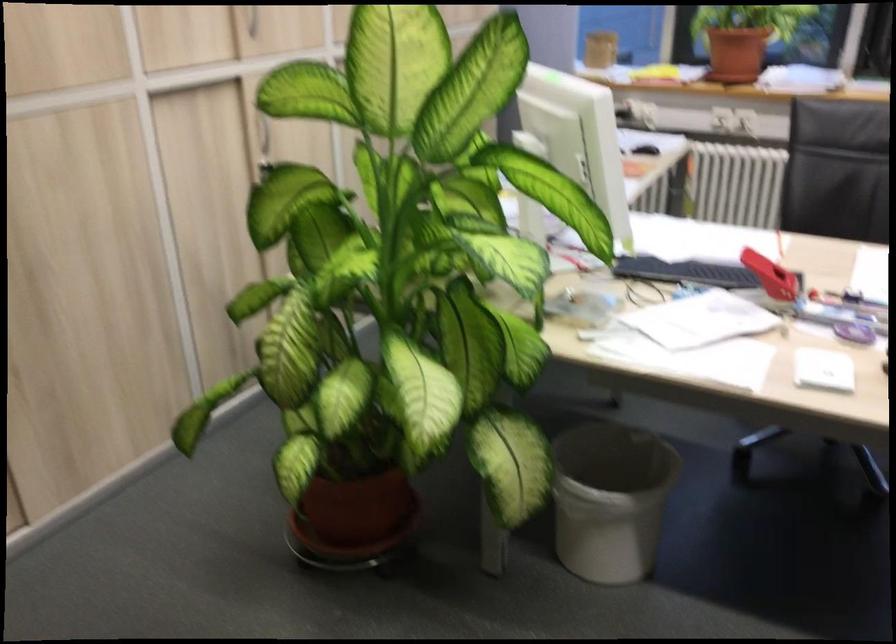
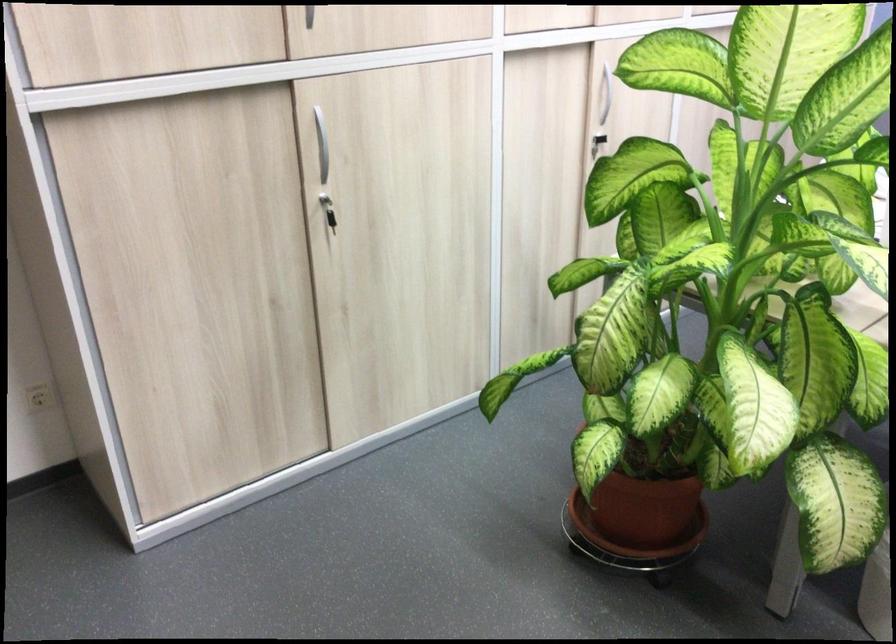
In the second image, find the point that corresponds to [369,567] in the first image.

(636, 564)